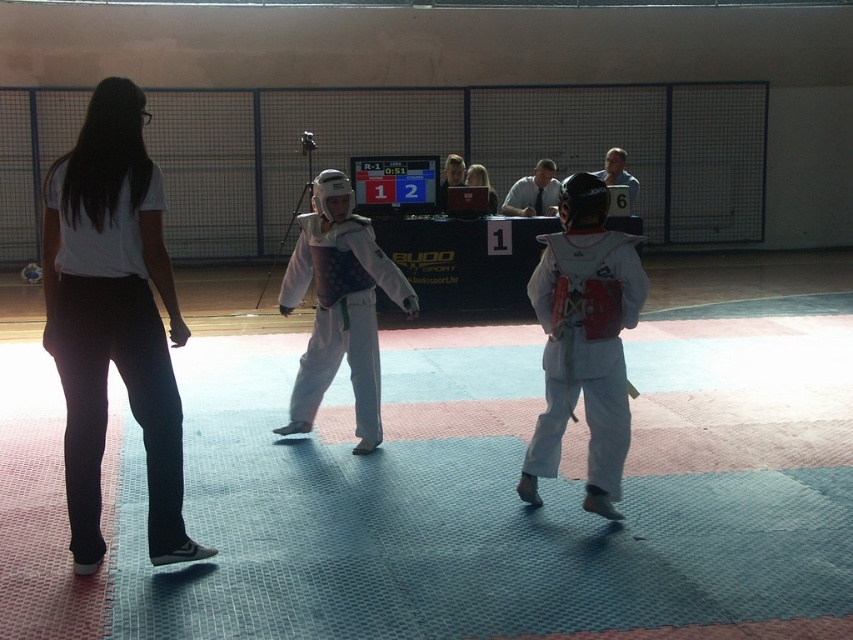
You are a photographer positioned at the back of the judo mat. You need to capture a clear photo of both the white matte pants at left and the white matte karate uniform at center. Which object will appear larger in your photo?

The white matte pants at left will appear larger in the photo because it is closer to the viewer than the white matte karate uniform at center.